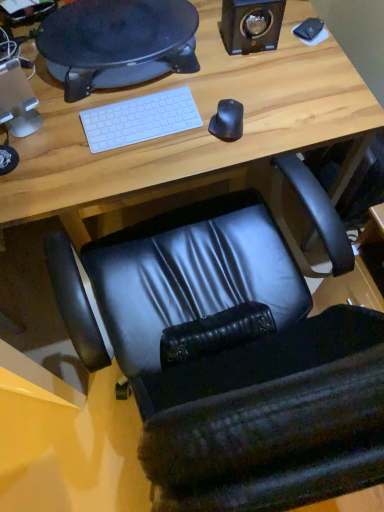
Locate an element on the screen. The image size is (384, 512). free space in front of black matte speaker at upper right is located at coordinates (252, 81).